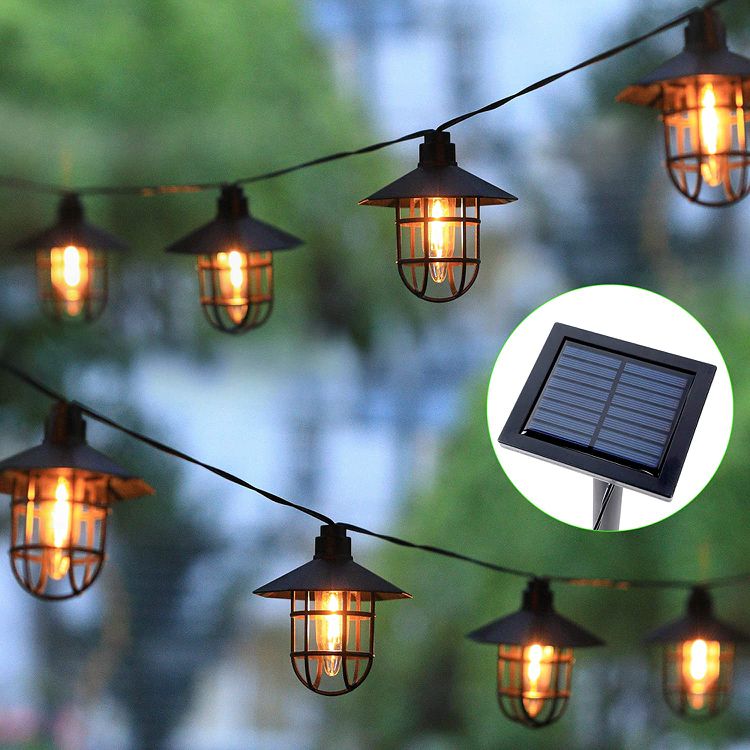
The image size is (750, 750). I want to click on wire holding lamps, so click(x=429, y=550).